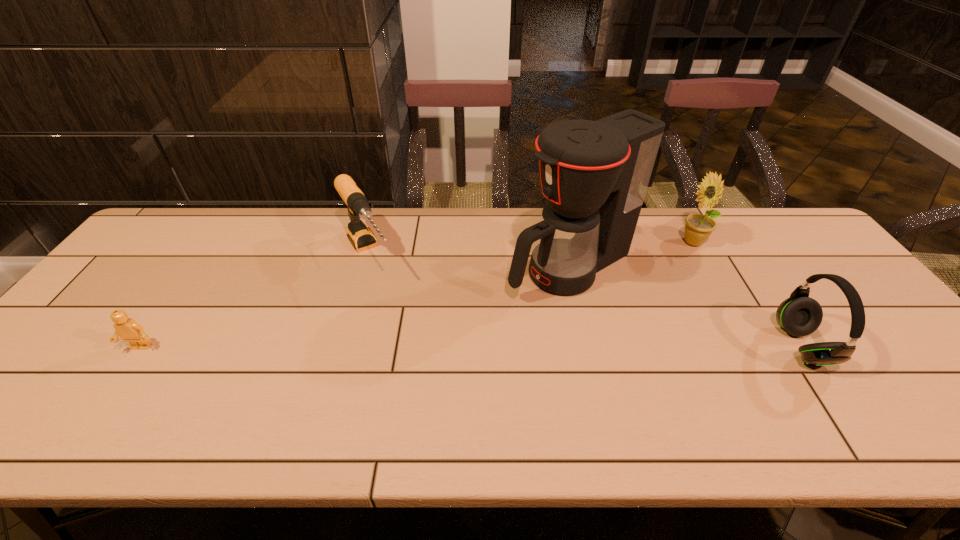
Identify the location of free space that satisfies the following two spatial constraints: 1. on the front side of the rightmost object; 2. on the ear cups of the sunflower. (752, 346).

Locate an element on the screen. free space in the image that satisfies the following two spatial constraints: 1. on the front side of the rightmost object; 2. on the ear cups of the coffee maker is located at coordinates (587, 346).

I want to click on vacant space that satisfies the following two spatial constraints: 1. on the front side of the rightmost object; 2. on the ear cups of the drill, so click(343, 346).

At what (x,y) coordinates should I click in order to perform the action: click on vacant space that satisfies the following two spatial constraints: 1. on the front side of the second object from left to right; 2. on the ear cups of the rightmost object. Please return your answer as a coordinate pair (x, y). The image size is (960, 540). Looking at the image, I should click on (343, 346).